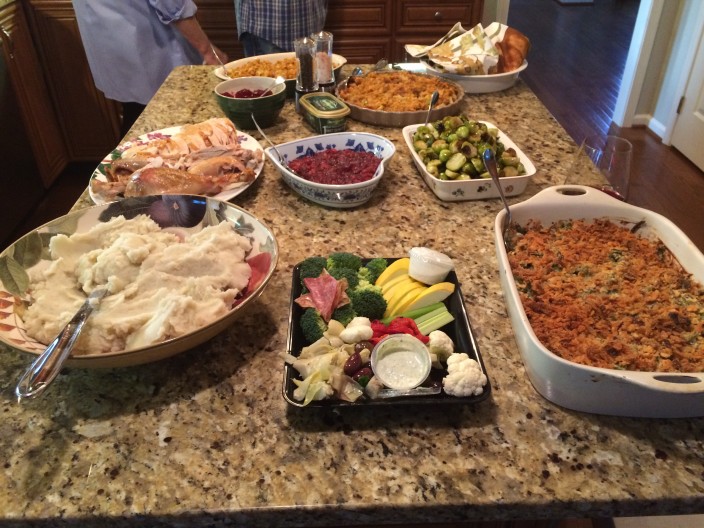
In order to click on heart-shaped dish in this screenshot , I will do `click(370, 184)`.